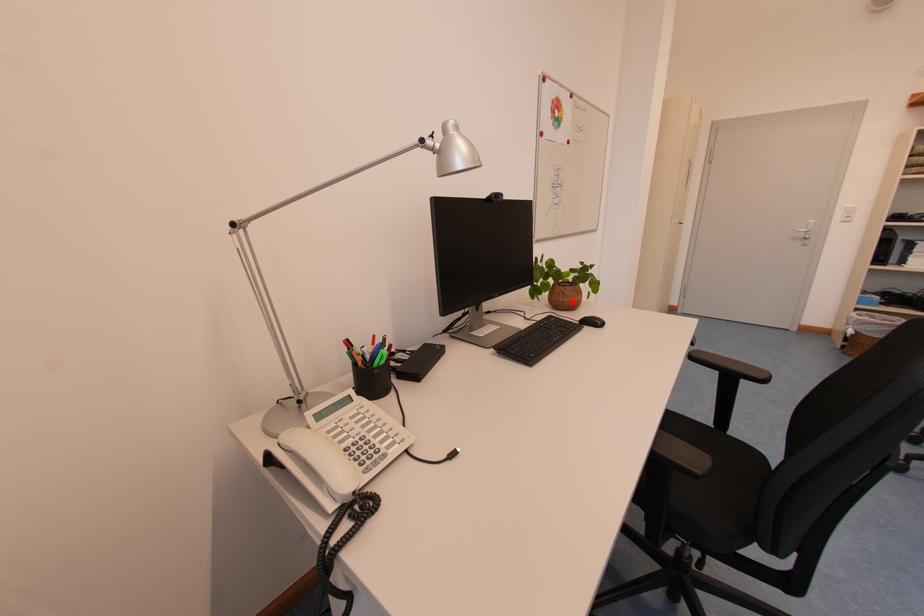
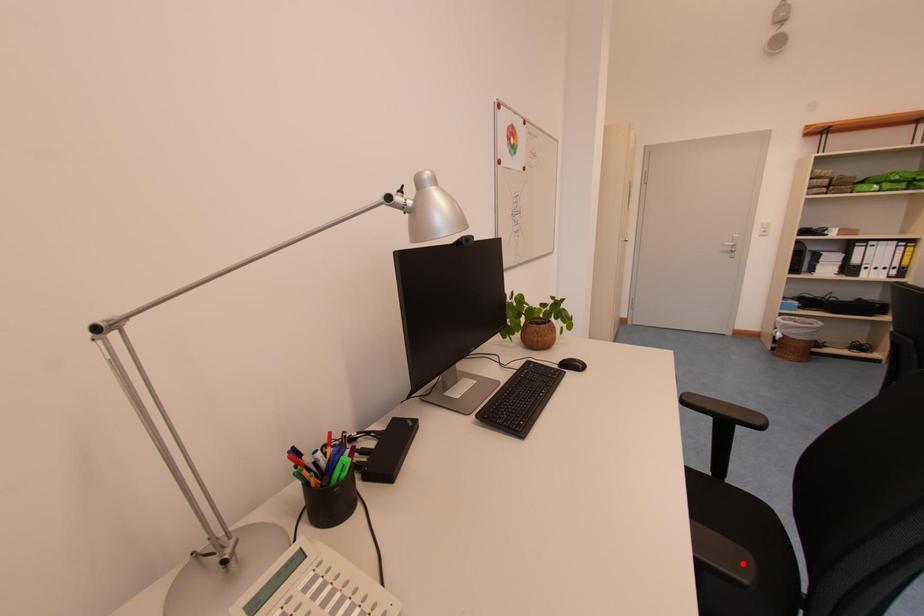
I am providing you with two images of the same scene from different viewpoints. A red point is marked on the first image and another point is marked on the second image. Is the marked point in image1 the same physical position as the marked point in image2?

No